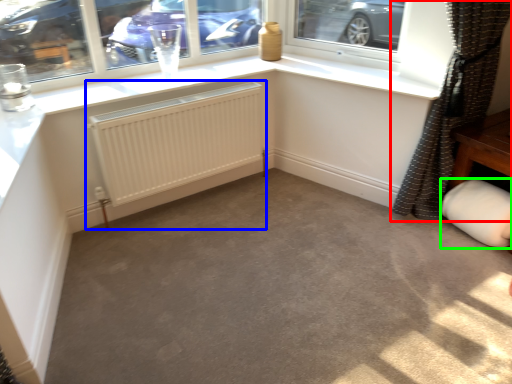
Question: Estimate the real-world distances between objects in this image. Which object is closer to curtain (highlighted by a red box), radiator (highlighted by a blue box) or gray (highlighted by a green box)?

Choices:
 (A) radiator
 (B) gray

Answer: (B)